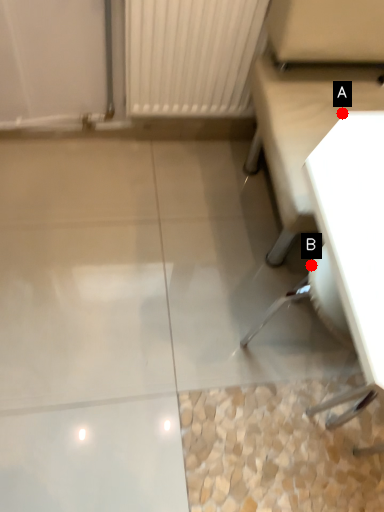
Question: Two points are circled on the image, labeled by A and B beside each circle. Which point appears farthest from the camera in this image?

Choices:
 (A) A is further
 (B) B is further

Answer: (A)